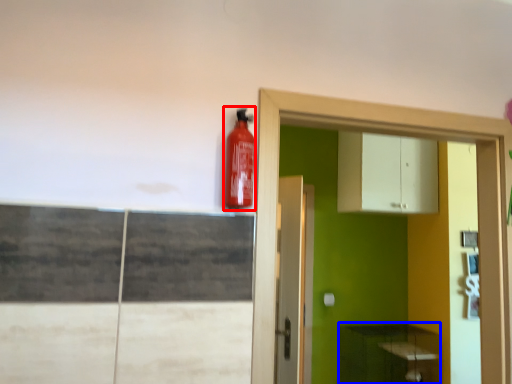
Question: Which point is closer to the camera, extinguisher (highlighted by a red box) or cabinetry (highlighted by a blue box)?

Choices:
 (A) extinguisher
 (B) cabinetry

Answer: (A)